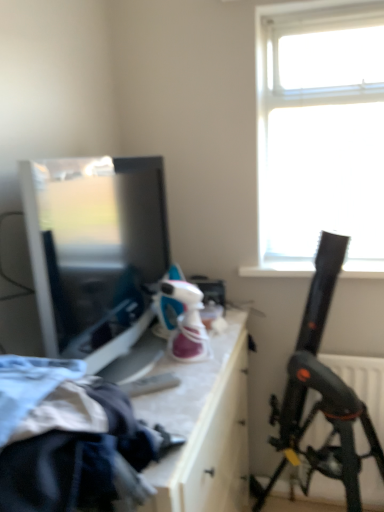
What do you see at coordinates (203, 428) in the screenshot? I see `white glossy drawer at center` at bounding box center [203, 428].

Image resolution: width=384 pixels, height=512 pixels. I want to click on black plastic telescope at right, so 320,393.

Would you say matte black television at left is inside or outside black plastic telescope at right?

matte black television at left is spatially situated outside black plastic telescope at right.

Which is further, (103, 346) or (285, 433)?

The point (285, 433) is farther from the camera.

Can you see matte black television at left touching black plastic telescope at right?

There is a gap between matte black television at left and black plastic telescope at right.

Is matte black television at left wider than black plastic telescope at right?

In fact, matte black television at left might be narrower than black plastic telescope at right.

Does black plastic telescope at right have a smaller size compared to matte black television at left?

No, black plastic telescope at right is not smaller than matte black television at left.

Is black plastic telescope at right not close to matte black television at left?

No, black plastic telescope at right is not far away from matte black television at left.

Is point (327, 475) positioned behind point (129, 200)?

Yes, it is behind point (129, 200).

This screenshot has width=384, height=512. In the image, there is a matte black television at left. In order to click on weapon below it (from the image's perspective) in this screenshot , I will do [320, 393].

From their relative heights in the image, would you say matte black television at left is taller or shorter than white glossy drawer at center?

Considering their sizes, matte black television at left has less height than white glossy drawer at center.

Consider the image. From a real-world perspective, relative to white glossy drawer at center, is matte black television at left vertically above or below?

From a real-world perspective, matte black television at left is physically above white glossy drawer at center.

Based on the photo, from the image's perspective, relative to white glossy drawer at center, is matte black television at left above or below?

Clearly, from the image's perspective, matte black television at left is above white glossy drawer at center.

Does matte black television at left come behind white glossy drawer at center?

Yes.

Considering the positions of objects black plastic telescope at right and white glossy drawer at center in the image provided, who is more to the right, black plastic telescope at right or white glossy drawer at center?

Positioned to the right is black plastic telescope at right.

From a real-world perspective, which is physically below, black plastic telescope at right or white glossy drawer at center?

In real-world perspective, white glossy drawer at center is lower.

Considering their positions, is black plastic telescope at right located in front of or behind white glossy drawer at center?

Visually, black plastic telescope at right is located behind white glossy drawer at center.

From a real-world perspective, is white glossy drawer at center physically above matte black television at left?

No, from a real-world perspective, white glossy drawer at center is not above matte black television at left.

Consider the image. Which of these two, white glossy drawer at center or matte black television at left, stands taller?

white glossy drawer at center.

Does white glossy drawer at center come in front of matte black television at left?

Yes, white glossy drawer at center is in front of matte black television at left.

Is white glossy drawer at center next to matte black television at left and touching it?

No, white glossy drawer at center is not touching matte black television at left.

From a real-world perspective, between white glossy drawer at center and black plastic telescope at right, who is vertically higher?

black plastic telescope at right is physically above.

Measure the distance between white glossy drawer at center and black plastic telescope at right.

They are 14.71 inches apart.

Is white glossy drawer at center bigger than black plastic telescope at right?

Yes.

Which object is closer to the camera, white glossy drawer at center or black plastic telescope at right?

Positioned in front is white glossy drawer at center.

The image size is (384, 512). I want to click on weapon to the right of matte black television at left, so click(x=320, y=393).

Locate an element on the screen. window screen above the black plastic telescope at right (from a real-world perspective) is located at coordinates (94, 250).

Estimate the real-world distances between objects in this image. Which object is closer to black plastic telescope at right, white glossy drawer at center or matte black television at left?

The object closer to black plastic telescope at right is white glossy drawer at center.

When comparing their distances from white glossy drawer at center, does black plastic telescope at right or matte black television at left seem closer?

Based on the image, black plastic telescope at right appears to be nearer to white glossy drawer at center.

Looking at the image, which one is located closer to matte black television at left, white glossy drawer at center or black plastic telescope at right?

white glossy drawer at center is positioned closer to the anchor matte black television at left.

Which object lies further to the anchor point matte black television at left, black plastic telescope at right or white glossy drawer at center?

black plastic telescope at right is positioned further to the anchor matte black television at left.

From the image, which object appears to be nearer to white glossy drawer at center, matte black television at left or black plastic telescope at right?

Based on the image, black plastic telescope at right appears to be nearer to white glossy drawer at center.

When comparing their distances from black plastic telescope at right, does matte black television at left or white glossy drawer at center seem closer?

white glossy drawer at center lies closer to black plastic telescope at right than the other object.

You are a GUI agent. You are given a task and a screenshot of the screen. Output one action in this format:
    pyautogui.click(x=<x>, y=<y>)
    Task: Click on the weapon between matte black television at left and white glossy drawer at center from top to bottom
    
    Given the screenshot: What is the action you would take?
    pyautogui.click(x=320, y=393)